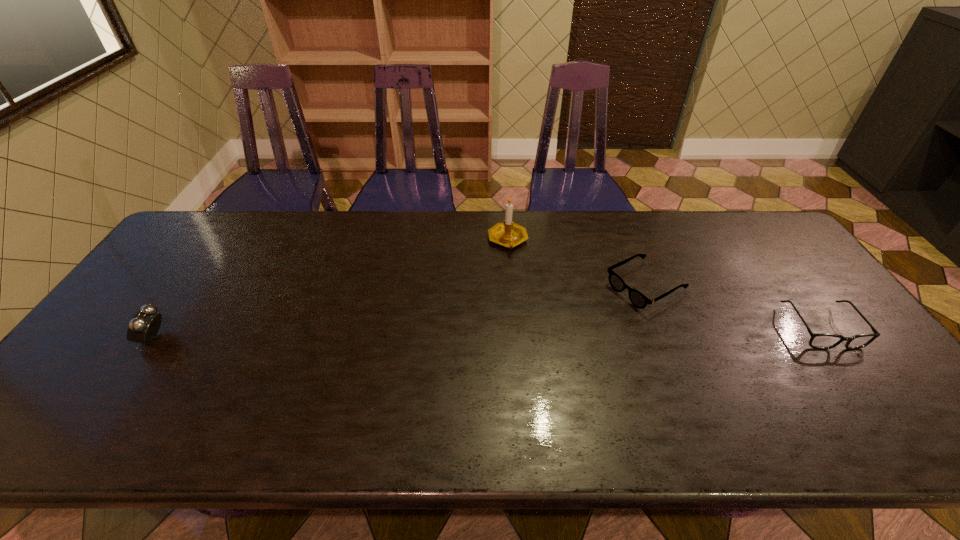
Find the location of a particular element. Image resolution: width=960 pixels, height=540 pixels. free space at the left edge of the desktop is located at coordinates (122, 338).

What are the coordinates of `vacant area at the right edge of the desktop` in the screenshot? It's located at (816, 356).

In the image, there is a desktop. At what (x,y) coordinates should I click in order to perform the action: click on vacant space at the far right corner. Please return your answer as a coordinate pair (x, y). Looking at the image, I should click on (731, 212).

In order to click on vacant area between the second object from left to right and the left spectacles in this screenshot , I will do `click(576, 264)`.

The image size is (960, 540). Find the location of `free space between the rightmost object and the leftmost object`. free space between the rightmost object and the leftmost object is located at coordinates coord(488,333).

Find the location of `unoccupied area between the left spectacles and the farthest object`. unoccupied area between the left spectacles and the farthest object is located at coordinates (576, 264).

This screenshot has width=960, height=540. Identify the location of free space between the alarm clock and the candle holder. (330, 289).

Where is `vacant area that lies between the leftmost object and the left spectacles`? This screenshot has width=960, height=540. vacant area that lies between the leftmost object and the left spectacles is located at coordinates (399, 313).

I want to click on free space between the alarm clock and the second object from right to left, so click(399, 313).

This screenshot has height=540, width=960. I want to click on free space between the left spectacles and the third shortest object, so click(x=399, y=313).